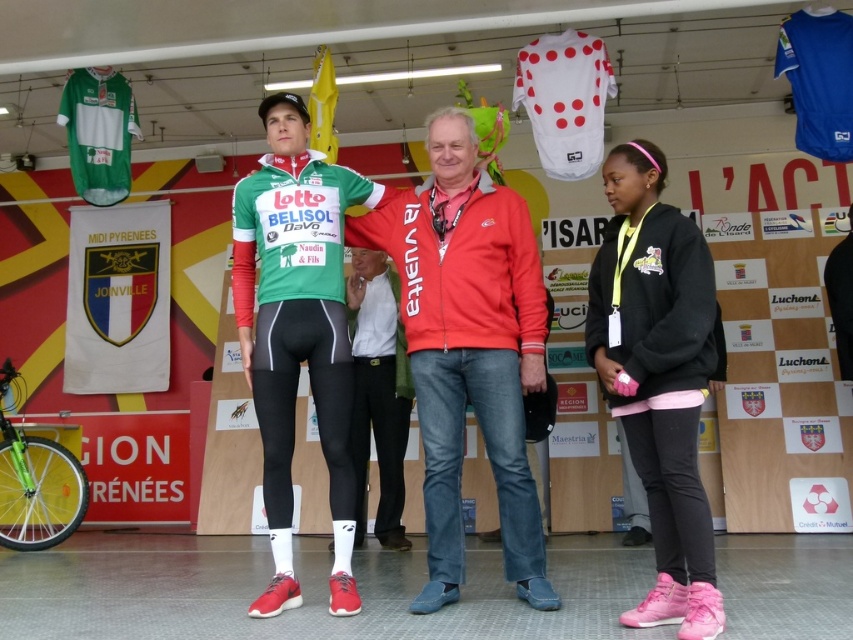
You are an event organizer at the cycling event. You need to hang two jackets on the podium for display. The red fabric jacket at center and the black fleece jacket at lower right. Which jacket should you choose to place on the higher hook if you want to arrange them vertically in order of their actual height?

The red fabric jacket at center has a greater height compared to the black fleece jacket at lower right, so you should place the red fabric jacket at center on the higher hook to reflect their actual heights.

You are a photographer positioned at the back of the stage. You need to take a photo that includes both the red fabric jacket at center and the black fleece jacket at lower right. Which jacket will appear closer to the camera in the final photo?

The red fabric jacket at center will appear closer to the camera because it is further to the viewer than the black fleece jacket at lower right, meaning it is positioned nearer to the photographer.

Where is the red fabric jacket at center located in the image?

The red fabric jacket at center is located at point (468, 348) in the image.